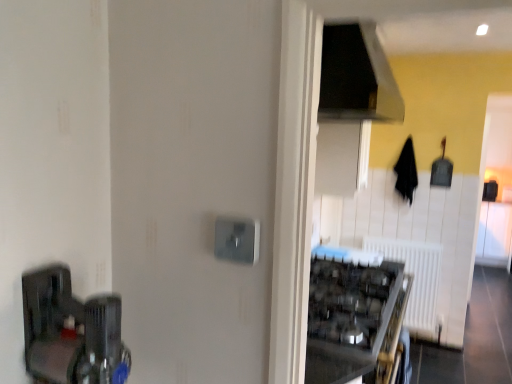
What is the approximate width of white plastic radiator at lower right?

The width of white plastic radiator at lower right is 5.32 inches.

I want to click on white plastic radiator at lower right, so click(415, 279).

Describe the element at coordinates (415, 279) in the screenshot. I see `white plastic radiator at lower right` at that location.

Locate an element on the screen. white plastic radiator at lower right is located at coordinates (415, 279).